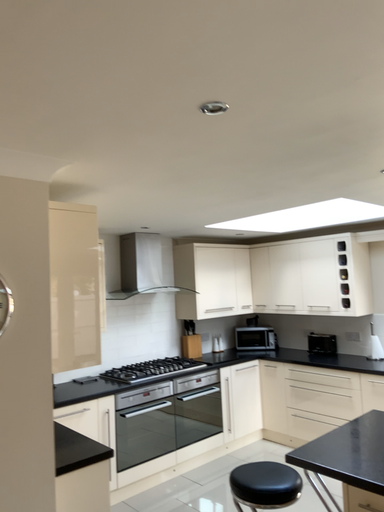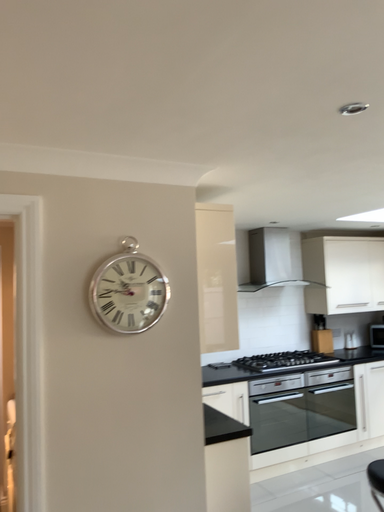
Question: Which way did the camera rotate in the video?

Choices:
 (A) rotated left
 (B) rotated right

Answer: (A)